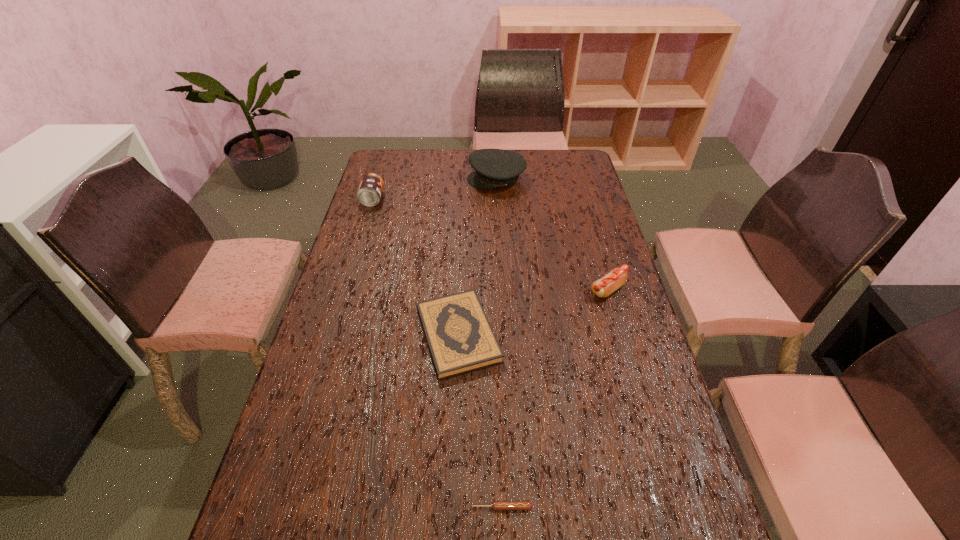
Identify the location of free space between the fourth tallest object and the can. Image resolution: width=960 pixels, height=540 pixels. (416, 267).

What are the coordinates of `unoccupied area between the tallest object and the hardback book` in the screenshot? It's located at (477, 257).

Identify which object is the second nearest to the can. Please provide its 2D coordinates. Your answer should be formatted as a tuple, i.e. [(x, y)], where the tuple contains the x and y coordinates of a point satisfying the conditions above.

[(460, 338)]

This screenshot has height=540, width=960. In order to click on object that is the second closest one to the tallest object in this screenshot , I will do tap(617, 277).

Where is `vacant region that satisfies the following two spatial constraints: 1. on the front-facing side of the beret; 2. on the back side of the third shortest object`? Image resolution: width=960 pixels, height=540 pixels. vacant region that satisfies the following two spatial constraints: 1. on the front-facing side of the beret; 2. on the back side of the third shortest object is located at coordinates (502, 290).

Where is `free space that satisfies the following two spatial constraints: 1. on the front label of the fourth shortest object; 2. on the left side of the nearest object`? free space that satisfies the following two spatial constraints: 1. on the front label of the fourth shortest object; 2. on the left side of the nearest object is located at coordinates (277, 507).

This screenshot has height=540, width=960. Identify the location of free spot that satisfies the following two spatial constraints: 1. on the front label of the can; 2. on the left side of the nearest object. (277, 507).

I want to click on vacant area in the image that satisfies the following two spatial constraints: 1. on the front-facing side of the beret; 2. on the back side of the rightmost object, so click(x=502, y=290).

Locate an element on the screen. The image size is (960, 540). free spot that satisfies the following two spatial constraints: 1. on the front label of the can; 2. on the right side of the second shortest object is located at coordinates (330, 335).